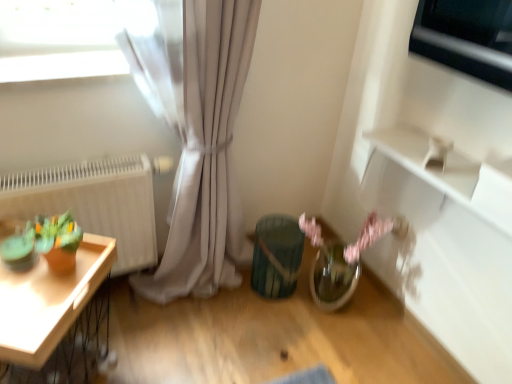
Question: From the image's perspective, is wooden tray at left above white matte radiator at left?

Choices:
 (A) no
 (B) yes

Answer: (A)

Question: Is there a large distance between wooden tray at left and white matte radiator at left?

Choices:
 (A) yes
 (B) no

Answer: (B)

Question: From a real-world perspective, is wooden tray at left physically above white matte radiator at left?

Choices:
 (A) no
 (B) yes

Answer: (A)

Question: Does wooden tray at left appear on the left side of white matte radiator at left?

Choices:
 (A) yes
 (B) no

Answer: (A)

Question: Can you confirm if wooden tray at left is smaller than white matte radiator at left?

Choices:
 (A) no
 (B) yes

Answer: (A)

Question: Is wooden tray at left at the right side of white matte radiator at left?

Choices:
 (A) yes
 (B) no

Answer: (B)

Question: Is metallic silver window at upper right wider than wooden tray at left?

Choices:
 (A) yes
 (B) no

Answer: (B)

Question: Is metallic silver window at upper right not inside wooden tray at left?

Choices:
 (A) no
 (B) yes

Answer: (B)

Question: Is metallic silver window at upper right at the right side of wooden tray at left?

Choices:
 (A) no
 (B) yes

Answer: (B)

Question: Does metallic silver window at upper right have a greater height compared to wooden tray at left?

Choices:
 (A) no
 (B) yes

Answer: (A)

Question: Is wooden tray at left at the back of metallic silver window at upper right?

Choices:
 (A) no
 (B) yes

Answer: (A)

Question: Considering the relative sizes of metallic silver window at upper right and wooden tray at left in the image provided, is metallic silver window at upper right thinner than wooden tray at left?

Choices:
 (A) no
 (B) yes

Answer: (B)

Question: Considering the relative sizes of teal textured vase at center and white matte radiator at left in the image provided, is teal textured vase at center wider than white matte radiator at left?

Choices:
 (A) no
 (B) yes

Answer: (B)